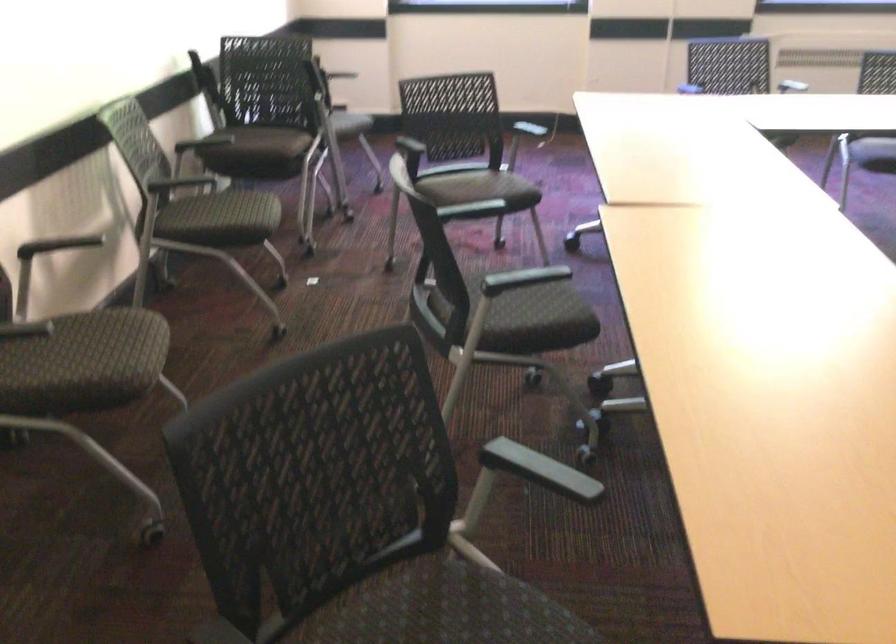
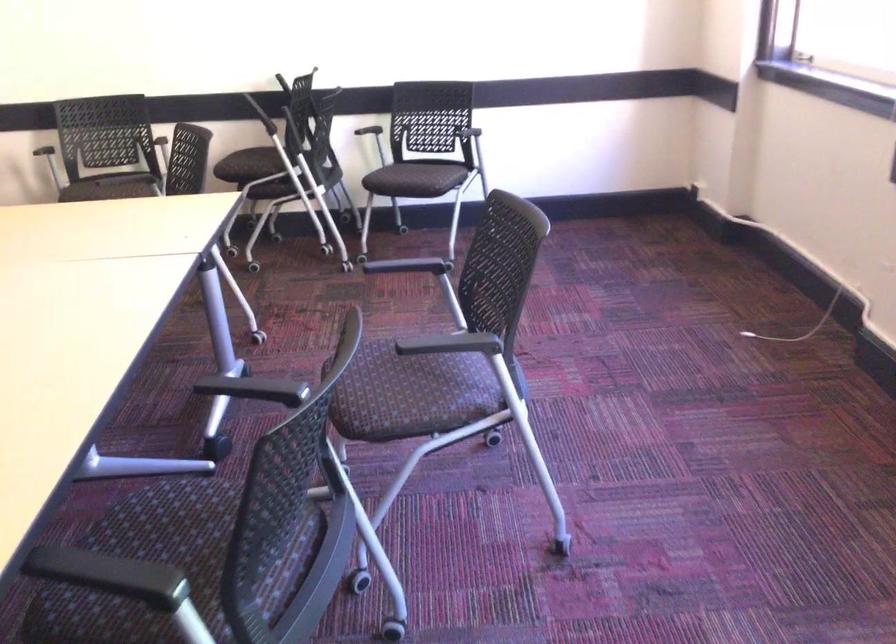
Find the pixel in the second image that matches (x=358, y=120) in the first image.

(415, 178)